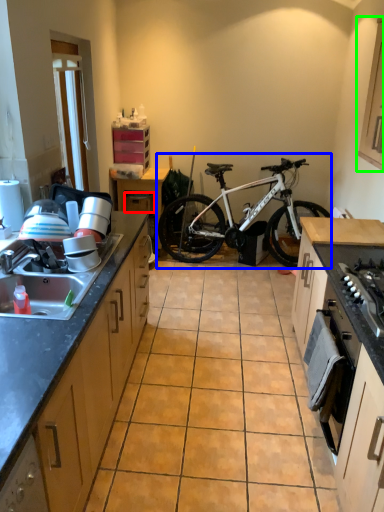
Question: Estimate the real-world distances between objects in this image. Which object is farther from drawer (highlighted by a red box), bicycle (highlighted by a blue box) or cabinetry (highlighted by a green box)?

Choices:
 (A) bicycle
 (B) cabinetry

Answer: (B)